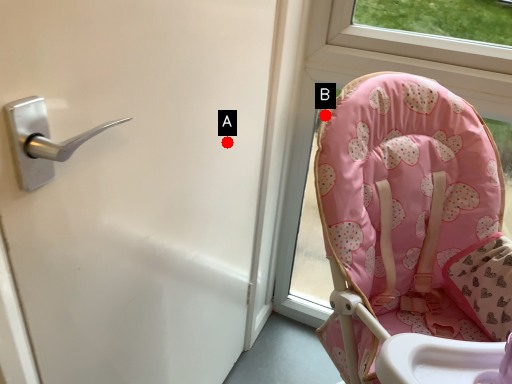
Question: Two points are circled on the image, labeled by A and B beside each circle. Among these points, which one is nearest to the camera?

Choices:
 (A) A is closer
 (B) B is closer

Answer: (A)